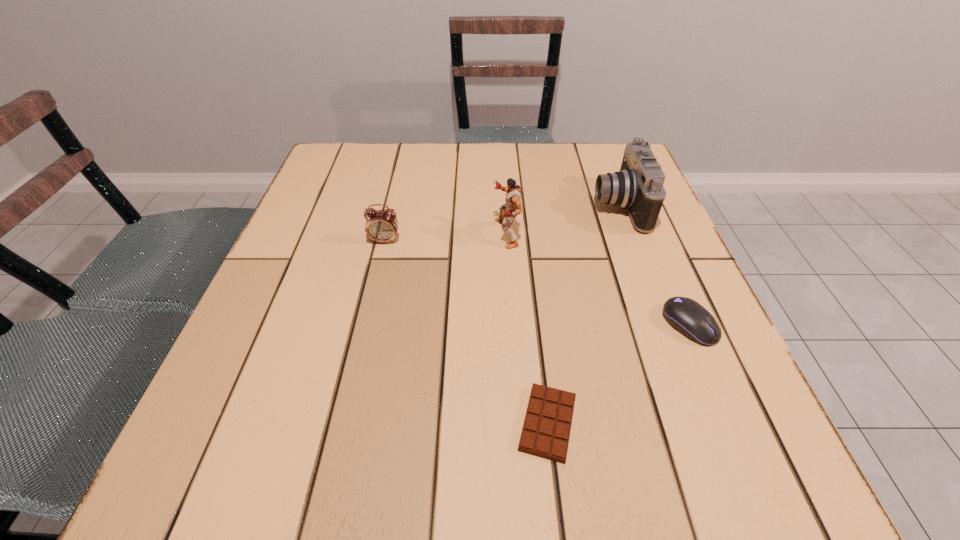
At what (x,y) coordinates should I click in order to perform the action: click on free point that satisfies the following two spatial constraints: 1. on the face of the third tallest object; 2. on the left side of the computer mouse. Please return your answer as a coordinate pair (x, y). The width and height of the screenshot is (960, 540). Looking at the image, I should click on (365, 325).

The height and width of the screenshot is (540, 960). Find the location of `free spot that satisfies the following two spatial constraints: 1. on the front-facing side of the camera; 2. on the face of the leftmost object`. free spot that satisfies the following two spatial constraints: 1. on the front-facing side of the camera; 2. on the face of the leftmost object is located at coordinates (632, 240).

You are a GUI agent. You are given a task and a screenshot of the screen. Output one action in this format:
    pyautogui.click(x=<x>, y=<y>)
    Task: Click on the vacant area that satisfies the following two spatial constraints: 1. on the front-facing side of the second nearest object; 2. on the left side of the puncher
    This screenshot has width=960, height=540.
    Given the screenshot: What is the action you would take?
    pyautogui.click(x=513, y=325)

You are a GUI agent. You are given a task and a screenshot of the screen. Output one action in this format:
    pyautogui.click(x=<x>, y=<y>)
    Task: Click on the vacant space that satisfies the following two spatial constraints: 1. on the back side of the fourth tallest object; 2. on the front-facing side of the camera
    Image resolution: width=960 pixels, height=540 pixels.
    Given the screenshot: What is the action you would take?
    pyautogui.click(x=638, y=206)

Where is `vacant space that satisfies the following two spatial constraints: 1. on the face of the third tallest object; 2. on the right side of the shortest object`? This screenshot has height=540, width=960. vacant space that satisfies the following two spatial constraints: 1. on the face of the third tallest object; 2. on the right side of the shortest object is located at coordinates (342, 423).

Find the location of `vacant space that satisfies the following two spatial constraints: 1. on the face of the leftmost object; 2. on the right side of the shortest object`. vacant space that satisfies the following two spatial constraints: 1. on the face of the leftmost object; 2. on the right side of the shortest object is located at coordinates (342, 423).

In order to click on free space in the image that satisfies the following two spatial constraints: 1. on the front-facing side of the camera; 2. on the front side of the nearest object in this screenshot , I will do `click(700, 423)`.

The image size is (960, 540). Find the location of `free spot that satisfies the following two spatial constraints: 1. on the front-facing side of the shortest object; 2. on the left side of the puncher`. free spot that satisfies the following two spatial constraints: 1. on the front-facing side of the shortest object; 2. on the left side of the puncher is located at coordinates [518, 423].